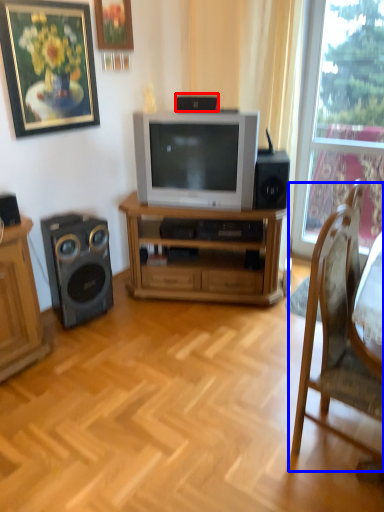
Question: Which object appears farthest to the camera in this image, speaker (highlighted by a red box) or chair (highlighted by a blue box)?

Choices:
 (A) speaker
 (B) chair

Answer: (A)